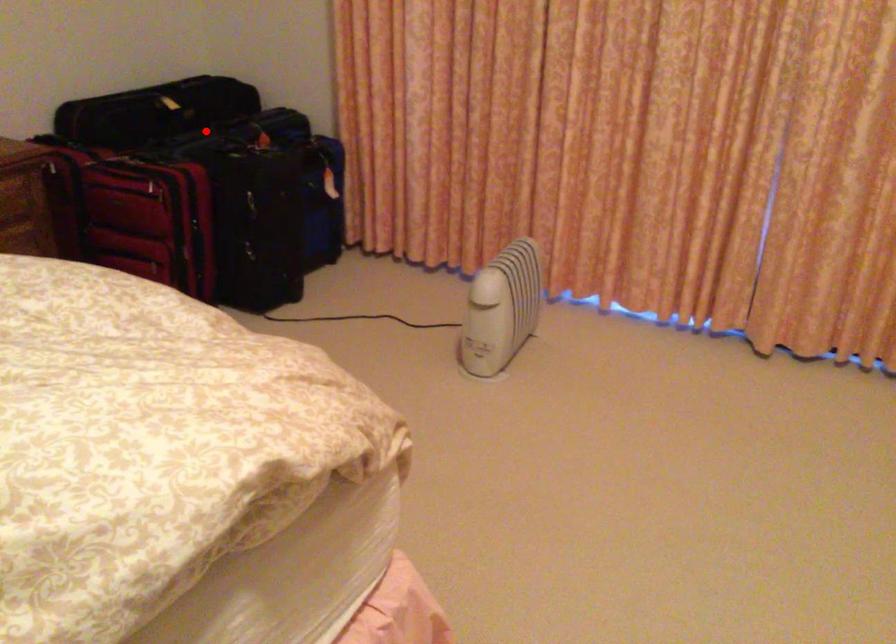
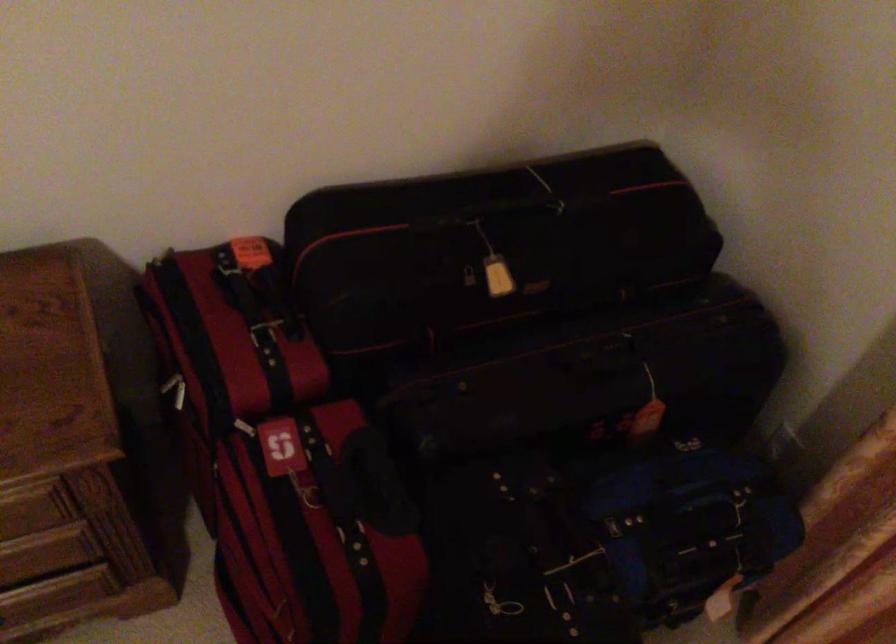
Question: I am providing you with two images of the same scene from different viewpoints. In image1, a red point is highlighted. Considering the same 3D point in image2, which of the following is correct?

Choices:
 (A) It is closer
 (B) It is farther

Answer: (A)